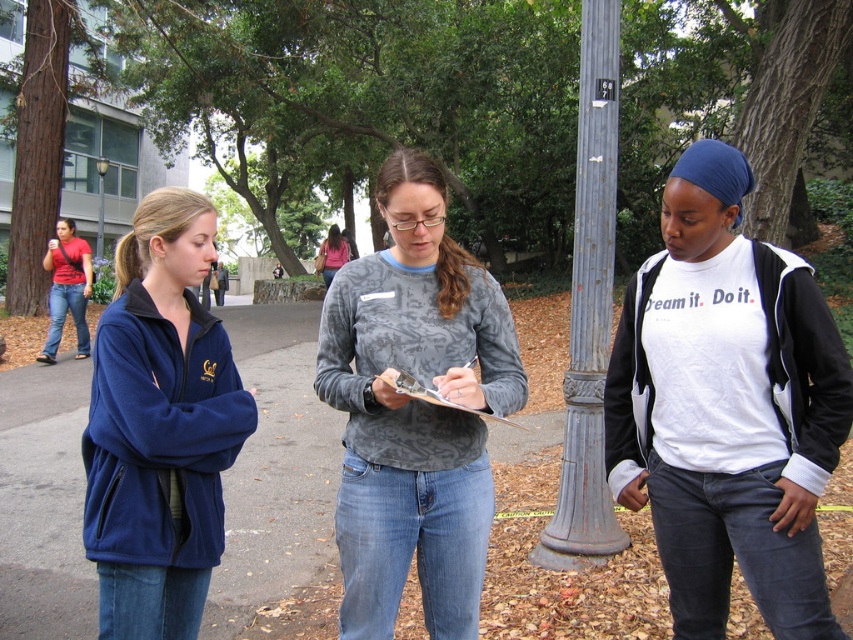
Question: Is white cotton t-shirt at center above brushed metal lamp post at upper center?

Choices:
 (A) yes
 (B) no

Answer: (B)

Question: From the image, what is the correct spatial relationship of gray textured sweatshirt at center in relation to brushed metal lamp post at upper center?

Choices:
 (A) left
 (B) right

Answer: (B)

Question: Which of these objects is positioned closest to the white cotton t-shirt at center?

Choices:
 (A) matte pink shirt at center
 (B) blue fleece jacket at left

Answer: (B)

Question: Which point is closer to the camera taking this photo?

Choices:
 (A) (515, 394)
 (B) (547, 541)
 (C) (172, 321)
 (D) (329, 244)

Answer: (C)

Question: Which object is closer to the camera taking this photo?

Choices:
 (A) matte red shirt at left
 (B) white cotton t-shirt at center
 (C) gray textured sweatshirt at center
 (D) matte pink shirt at center

Answer: (B)

Question: Can you confirm if gray textured shirt at center is positioned below rusty metal pole at center?

Choices:
 (A) yes
 (B) no

Answer: (A)